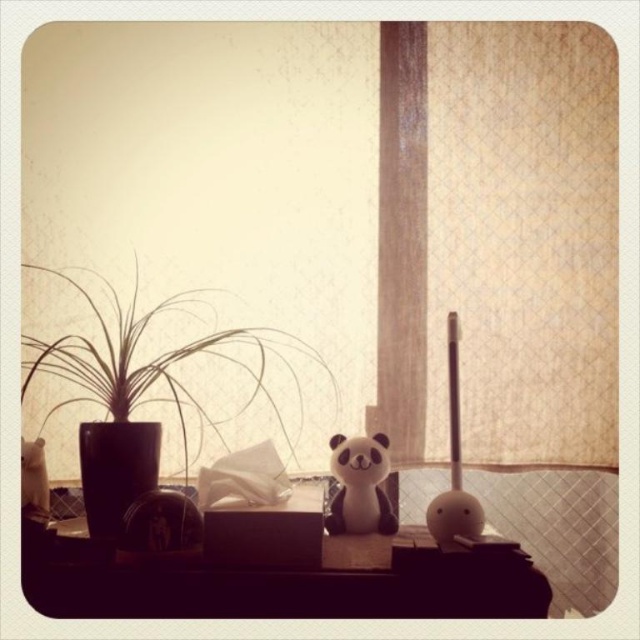
Question: Which point is farther from the camera taking this photo?

Choices:
 (A) (177, 348)
 (B) (394, 588)

Answer: (A)

Question: Can you confirm if white textured curtain at center is positioned to the left of black wood table at center?

Choices:
 (A) yes
 (B) no

Answer: (B)

Question: Is the position of black wood table at center more distant than that of green matte plant at left?

Choices:
 (A) yes
 (B) no

Answer: (A)

Question: Which point is closer to the camera taking this photo?

Choices:
 (A) (218, 353)
 (B) (51, 532)
 (C) (340, 451)

Answer: (B)

Question: Which point appears farthest from the camera in this image?

Choices:
 (A) (166, 378)
 (B) (589, 374)
 (C) (332, 458)
 (D) (26, 566)

Answer: (B)

Question: Is the position of white textured curtain at center more distant than that of white plush bear at center?

Choices:
 (A) no
 (B) yes

Answer: (B)